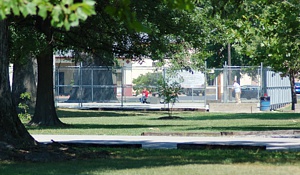
Where is `door`? door is located at coordinates (61, 82).